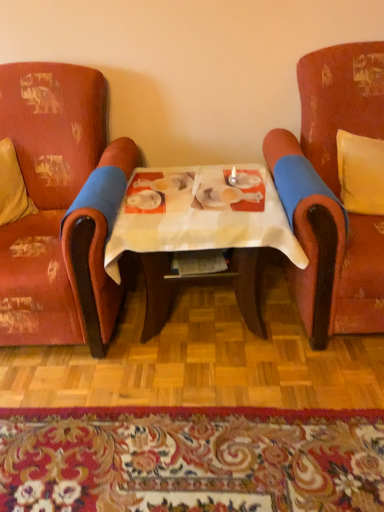
This screenshot has height=512, width=384. Identify the location of free point above white paper table at center (from a real-world perspective). (197, 200).